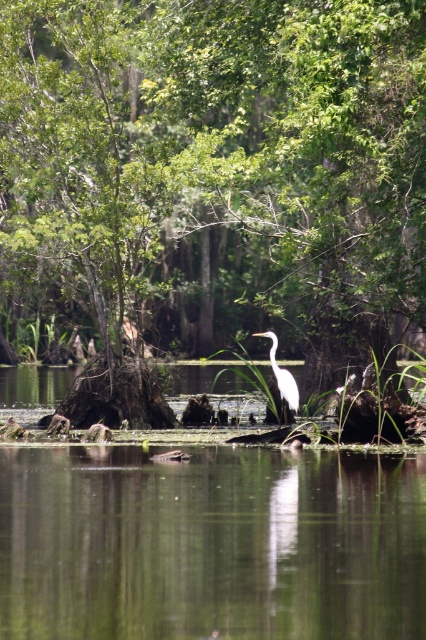
You are a photographer standing at the edge of the swamp. You see the clear water at center and the white smooth heron at center. Which object is located more to the left?

The clear water at center is positioned on the left side of the white smooth heron at center, so the clear water at center is more to the left.

You are standing at the edge of the swampy area and notice a point marked at coordinates (218, 172). What object is located at that specific point?

At point (218, 172) lies green leafy tree at center.